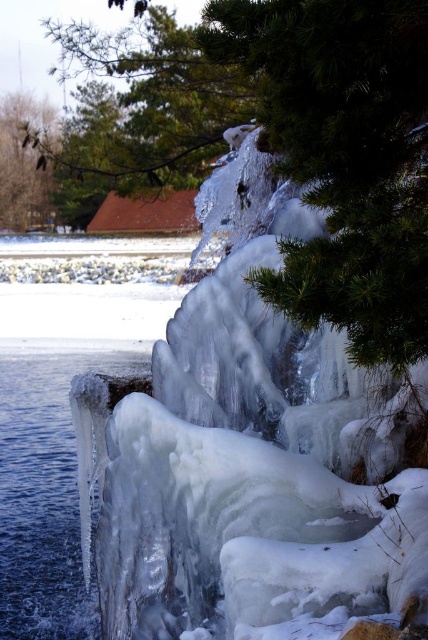
Question: Is the position of green matte tree at upper center less distant than that of clear ice water at lower left?

Choices:
 (A) no
 (B) yes

Answer: (A)

Question: Which point appears farthest from the camera in this image?

Choices:
 (A) [171, 138]
 (B) [17, 228]

Answer: (B)

Question: Which of these objects is positioned farthest from the green textured pine branch at upper left?

Choices:
 (A) green matte tree at upper center
 (B) clear ice water at lower left

Answer: (B)

Question: Which object appears farthest from the camera in this image?

Choices:
 (A) clear ice water at lower left
 (B) green matte tree at upper center

Answer: (B)

Question: Does green matte tree at upper center appear over clear ice water at lower left?

Choices:
 (A) yes
 (B) no

Answer: (A)

Question: Is clear ice water at lower left thinner than green textured pine branch at upper left?

Choices:
 (A) no
 (B) yes

Answer: (A)